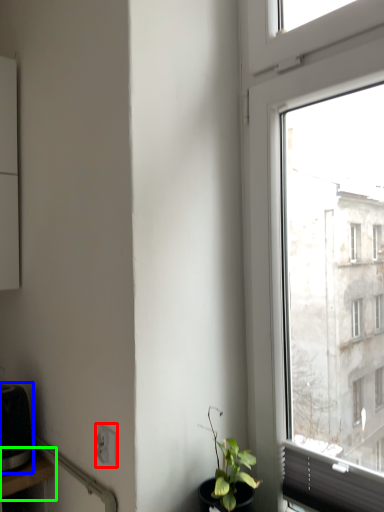
Question: Which object is the closest to the power plugs and sockets (highlighted by a red box)? Choose among these: appliance (highlighted by a blue box) or table (highlighted by a green box).

Choices:
 (A) appliance
 (B) table

Answer: (B)